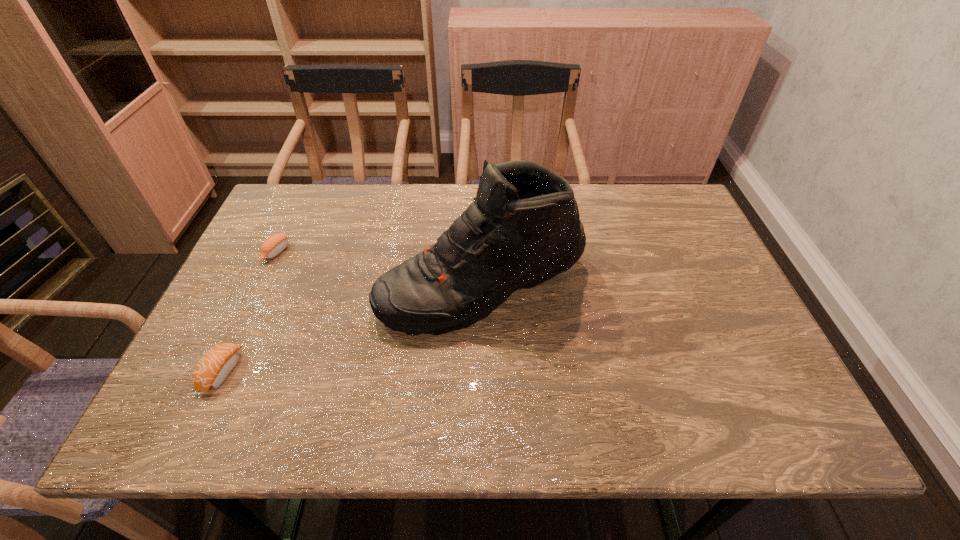
Find the location of a particular element. Image resolution: width=960 pixels, height=540 pixels. ski boot is located at coordinates (523, 228).

Where is `the rightmost object`? The height and width of the screenshot is (540, 960). the rightmost object is located at coordinates (523, 228).

Image resolution: width=960 pixels, height=540 pixels. Identify the location of the farther sushi. (275, 244).

The width and height of the screenshot is (960, 540). What are the coordinates of `the nearest object` in the screenshot? It's located at (213, 368).

You are a GUI agent. You are given a task and a screenshot of the screen. Output one action in this format:
    pyautogui.click(x=<x>, y=<y>)
    Task: Click on the vacant space situated on the front of the ski boot
    
    Given the screenshot: What is the action you would take?
    pyautogui.click(x=483, y=377)

This screenshot has height=540, width=960. Identify the location of vacant space situated on the right of the farther sushi. (339, 252).

What are the coordinates of `free location located 0.130m on the right of the nearer sushi` in the screenshot? It's located at (297, 372).

In order to click on blank space at the far edge of the desktop in this screenshot , I will do click(x=450, y=208).

The image size is (960, 540). In the image, there is a desktop. In order to click on vacant space at the near edge in this screenshot , I will do `click(419, 431)`.

Find the location of a particular element. The image size is (960, 540). vacant space at the left edge of the desktop is located at coordinates (279, 303).